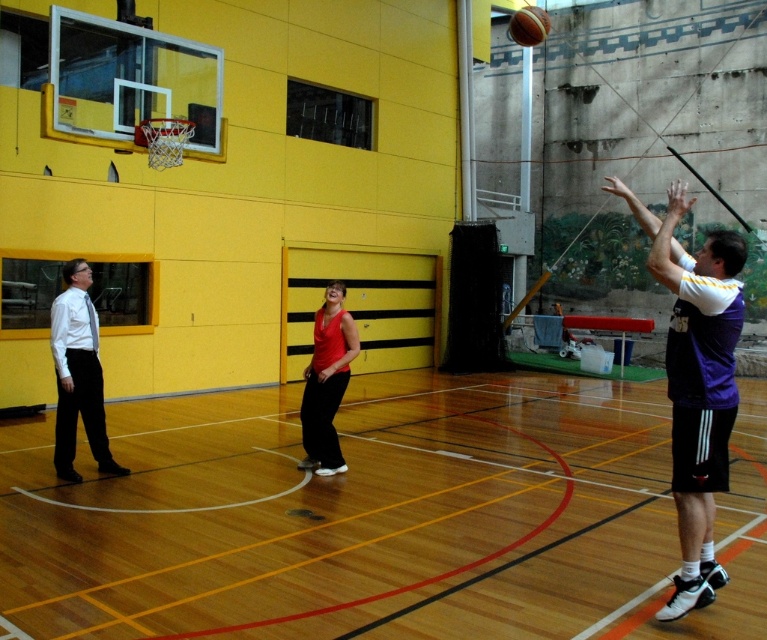
Question: Which object appears closest to the camera in this image?

Choices:
 (A) purple jersey at upper right
 (B) matte red tank top at center

Answer: (A)

Question: Can you confirm if wooden floor at center is thinner than purple jersey at upper right?

Choices:
 (A) no
 (B) yes

Answer: (A)

Question: Estimate the real-world distances between objects in this image. Which object is farther from the rubber textured basketball at upper center?

Choices:
 (A) white shirt at left
 (B) matte red tank top at center

Answer: (A)

Question: Can you confirm if purple jersey at upper right is positioned below rubber textured basketball at upper center?

Choices:
 (A) yes
 (B) no

Answer: (A)

Question: Is matte red tank top at center thinner than rubber textured basketball at upper center?

Choices:
 (A) yes
 (B) no

Answer: (A)

Question: Which object appears closest to the camera in this image?

Choices:
 (A) matte red tank top at center
 (B) white shirt at left
 (C) purple jersey at upper right

Answer: (C)